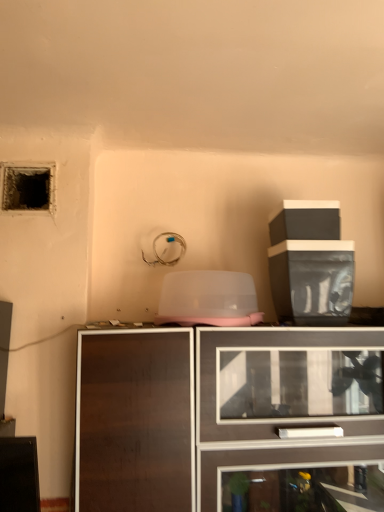
Question: Does black plastic container at upper right, acting as the 2th cabinetry starting from the bottom, have a lesser height compared to dark textured hole at upper left?

Choices:
 (A) yes
 (B) no

Answer: (B)

Question: Considering the relative sizes of black plastic container at upper right, placed as the 1th cabinetry when sorted from top to bottom, and dark textured hole at upper left in the image provided, is black plastic container at upper right, placed as the 1th cabinetry when sorted from top to bottom, smaller than dark textured hole at upper left?

Choices:
 (A) no
 (B) yes

Answer: (A)

Question: Is the depth of black plastic container at upper right, placed as the 1th cabinetry when sorted from top to bottom, less than that of dark textured hole at upper left?

Choices:
 (A) no
 (B) yes

Answer: (B)

Question: Considering the relative sizes of black plastic container at upper right, placed as the 1th cabinetry when sorted from top to bottom, and dark textured hole at upper left in the image provided, is black plastic container at upper right, placed as the 1th cabinetry when sorted from top to bottom, wider than dark textured hole at upper left?

Choices:
 (A) no
 (B) yes

Answer: (B)

Question: Considering the relative positions of black plastic container at upper right, placed as the 1th cabinetry when sorted from top to bottom, and dark textured hole at upper left in the image provided, is black plastic container at upper right, placed as the 1th cabinetry when sorted from top to bottom, behind dark textured hole at upper left?

Choices:
 (A) no
 (B) yes

Answer: (A)

Question: Looking at their shapes, would you say black plastic container at upper right, placed as the 1th cabinetry when sorted from top to bottom, is wider or thinner than dark wood cabinet at center, the 1th cabinetry when ordered from bottom to top?

Choices:
 (A) wide
 (B) thin

Answer: (B)

Question: Is black plastic container at upper right, acting as the 2th cabinetry starting from the bottom, taller or shorter than dark wood cabinet at center, the second cabinetry positioned from the top?

Choices:
 (A) tall
 (B) short

Answer: (B)

Question: From the image's perspective, is black plastic container at upper right, acting as the 2th cabinetry starting from the bottom, above or below dark wood cabinet at center, the 1th cabinetry when ordered from bottom to top?

Choices:
 (A) below
 (B) above

Answer: (B)

Question: Is black plastic container at upper right, acting as the 2th cabinetry starting from the bottom, to the left or to the right of dark wood cabinet at center, the second cabinetry positioned from the top, in the image?

Choices:
 (A) right
 (B) left

Answer: (A)

Question: From a real-world perspective, is dark textured hole at upper left positioned above or below dark wood cabinet at center, the second cabinetry positioned from the top?

Choices:
 (A) below
 (B) above

Answer: (B)

Question: From the image's perspective, is dark textured hole at upper left located above or below dark wood cabinet at center, the 1th cabinetry when ordered from bottom to top?

Choices:
 (A) above
 (B) below

Answer: (A)

Question: Is point (33, 180) positioned closer to the camera than point (241, 487)?

Choices:
 (A) farther
 (B) closer

Answer: (A)

Question: In the image, is dark textured hole at upper left positioned in front of or behind dark wood cabinet at center, the 1th cabinetry when ordered from bottom to top?

Choices:
 (A) behind
 (B) front

Answer: (A)

Question: Considering the positions of dark wood cabinet at center, the second cabinetry positioned from the top, and black plastic container at upper right, acting as the 2th cabinetry starting from the bottom, in the image, is dark wood cabinet at center, the second cabinetry positioned from the top, bigger or smaller than black plastic container at upper right, acting as the 2th cabinetry starting from the bottom,?

Choices:
 (A) small
 (B) big

Answer: (B)

Question: Relative to black plastic container at upper right, acting as the 2th cabinetry starting from the bottom, is dark wood cabinet at center, the second cabinetry positioned from the top, in front or behind?

Choices:
 (A) front
 (B) behind

Answer: (A)